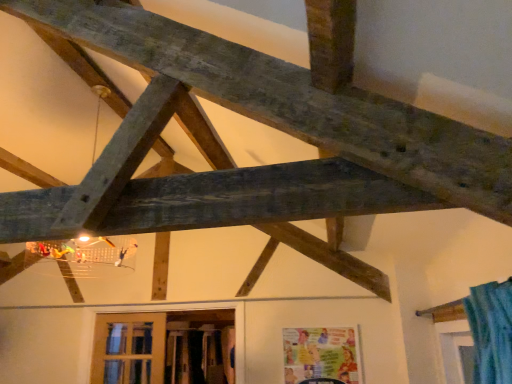
How much space does wooden frame at lower center, the first window when ordered from right to left, occupy horizontally?

wooden frame at lower center, the first window when ordered from right to left, is 3.35 inches wide.

Describe the element at coordinates (163, 347) in the screenshot. I see `wooden frame at lower center, placed as the second window when sorted from left to right` at that location.

Identify the location of wooden frame at lower center, placed as the second window when sorted from left to right. This screenshot has width=512, height=384. (163, 347).

Find the location of a particular element. wooden-framed window at lower left, the 2th window viewed from the right is located at coordinates (128, 353).

Describe the element at coordinates (128, 353) in the screenshot. I see `wooden-framed window at lower left, the 2th window viewed from the right` at that location.

Where is `wooden frame at lower center, placed as the second window when sorted from left to right`? wooden frame at lower center, placed as the second window when sorted from left to right is located at coordinates (163, 347).

Based on the photo, would you say wooden frame at lower center, the first window when ordered from right to left, is to the left or to the right of wooden-framed window at lower left, the 2th window viewed from the right, in the picture?

Based on their positions, wooden frame at lower center, the first window when ordered from right to left, is located to the right of wooden-framed window at lower left, the 2th window viewed from the right.

Is the position of wooden frame at lower center, the first window when ordered from right to left, less distant than that of wooden-framed window at lower left, the 2th window viewed from the right?

A: Yes, wooden frame at lower center, the first window when ordered from right to left, is closer to the viewer.

Considering the positions of point (110, 345) and point (143, 329), is point (110, 345) closer or farther from the camera than point (143, 329)?

Point (110, 345).

From the image's perspective, between wooden frame at lower center, placed as the second window when sorted from left to right, and wooden-framed window at lower left, which is the first window in left-to-right order, who is located below?

wooden-framed window at lower left, which is the first window in left-to-right order, is shown below in the image.

From a real-world perspective, is wooden frame at lower center, the first window when ordered from right to left, physically located above or below wooden-framed window at lower left, the 2th window viewed from the right?

wooden frame at lower center, the first window when ordered from right to left, is situated higher than wooden-framed window at lower left, the 2th window viewed from the right, in the real world.

Between wooden frame at lower center, placed as the second window when sorted from left to right, and wooden-framed window at lower left, which is the first window in left-to-right order, which one has smaller width?

wooden-framed window at lower left, which is the first window in left-to-right order, is thinner.

Can you confirm if wooden frame at lower center, placed as the second window when sorted from left to right, is taller than wooden-framed window at lower left, which is the first window in left-to-right order?

Indeed, wooden frame at lower center, placed as the second window when sorted from left to right, has a greater height compared to wooden-framed window at lower left, which is the first window in left-to-right order.

Can you confirm if wooden frame at lower center, placed as the second window when sorted from left to right, is smaller than wooden-framed window at lower left, the 2th window viewed from the right?

Incorrect, wooden frame at lower center, placed as the second window when sorted from left to right, is not smaller in size than wooden-framed window at lower left, the 2th window viewed from the right.

Choose the correct answer: Is wooden frame at lower center, the first window when ordered from right to left, inside wooden-framed window at lower left, which is the first window in left-to-right order, or outside it?

wooden frame at lower center, the first window when ordered from right to left, lies outside wooden-framed window at lower left, which is the first window in left-to-right order.

Are wooden frame at lower center, placed as the second window when sorted from left to right, and wooden-framed window at lower left, which is the first window in left-to-right order, located far from each other?

No, wooden frame at lower center, placed as the second window when sorted from left to right, is not far away from wooden-framed window at lower left, which is the first window in left-to-right order.

Is wooden-framed window at lower left, which is the first window in left-to-right order, at the back of wooden frame at lower center, the first window when ordered from right to left?

Yes.

Where is `window below the wooden frame at lower center, the first window when ordered from right to left (from a real-world perspective)`? window below the wooden frame at lower center, the first window when ordered from right to left (from a real-world perspective) is located at coordinates (128, 353).

Considering the positions of objects wooden-framed window at lower left, which is the first window in left-to-right order, and wooden frame at lower center, the first window when ordered from right to left, in the image provided, who is more to the right, wooden-framed window at lower left, which is the first window in left-to-right order, or wooden frame at lower center, the first window when ordered from right to left,?

Positioned to the right is wooden frame at lower center, the first window when ordered from right to left.

Between wooden-framed window at lower left, which is the first window in left-to-right order, and wooden frame at lower center, the first window when ordered from right to left, which one is positioned behind?

wooden-framed window at lower left, which is the first window in left-to-right order, is behind.

Which is nearer, (142, 334) or (180, 350)?

Point (142, 334) appears to be closer to the viewer than point (180, 350).

From the image's perspective, between wooden-framed window at lower left, the 2th window viewed from the right, and wooden frame at lower center, the first window when ordered from right to left, who is located below?

wooden-framed window at lower left, the 2th window viewed from the right, is shown below in the image.

From a real-world perspective, which object rests below the other?

From a 3D spatial view, wooden-framed window at lower left, which is the first window in left-to-right order, is below.

Considering the sizes of wooden-framed window at lower left, the 2th window viewed from the right, and wooden frame at lower center, placed as the second window when sorted from left to right, in the image, is wooden-framed window at lower left, the 2th window viewed from the right, wider or thinner than wooden frame at lower center, placed as the second window when sorted from left to right,?

wooden-framed window at lower left, the 2th window viewed from the right, is thinner than wooden frame at lower center, placed as the second window when sorted from left to right.

Considering the sizes of wooden-framed window at lower left, the 2th window viewed from the right, and wooden frame at lower center, the first window when ordered from right to left, in the image, is wooden-framed window at lower left, the 2th window viewed from the right, taller or shorter than wooden frame at lower center, the first window when ordered from right to left,?

wooden-framed window at lower left, the 2th window viewed from the right, is shorter than wooden frame at lower center, the first window when ordered from right to left.

In terms of size, does wooden-framed window at lower left, which is the first window in left-to-right order, appear bigger or smaller than wooden frame at lower center, placed as the second window when sorted from left to right?

Considering their sizes, wooden-framed window at lower left, which is the first window in left-to-right order, takes up less space than wooden frame at lower center, placed as the second window when sorted from left to right.

Is wooden-framed window at lower left, the 2th window viewed from the right, not inside wooden frame at lower center, the first window when ordered from right to left?

No, wooden-framed window at lower left, the 2th window viewed from the right, is not outside of wooden frame at lower center, the first window when ordered from right to left.

Would you consider wooden-framed window at lower left, the 2th window viewed from the right, to be distant from wooden frame at lower center, the first window when ordered from right to left?

They are positioned close to each other.

Is wooden frame at lower center, the first window when ordered from right to left, at the back of wooden-framed window at lower left, which is the first window in left-to-right order?

No, wooden-framed window at lower left, which is the first window in left-to-right order, is not facing away from wooden frame at lower center, the first window when ordered from right to left.

How different are the orientations of wooden-framed window at lower left, which is the first window in left-to-right order, and wooden frame at lower center, the first window when ordered from right to left, in degrees?

They differ by 0.00904 degrees in their facing directions.

How much distance is there between wooden-framed window at lower left, which is the first window in left-to-right order, and wooden frame at lower center, placed as the second window when sorted from left to right?

A distance of 5.14 inches exists between wooden-framed window at lower left, which is the first window in left-to-right order, and wooden frame at lower center, placed as the second window when sorted from left to right.

Find the location of `window that is on the right side of wooden-framed window at lower left, which is the first window in left-to-right order`. window that is on the right side of wooden-framed window at lower left, which is the first window in left-to-right order is located at coordinates point(163,347).

The height and width of the screenshot is (384, 512). In order to click on window that is under the wooden frame at lower center, the first window when ordered from right to left (from a real-world perspective) in this screenshot , I will do `click(128, 353)`.

Find the location of `window in front of the wooden-framed window at lower left, which is the first window in left-to-right order`. window in front of the wooden-framed window at lower left, which is the first window in left-to-right order is located at coordinates (163, 347).